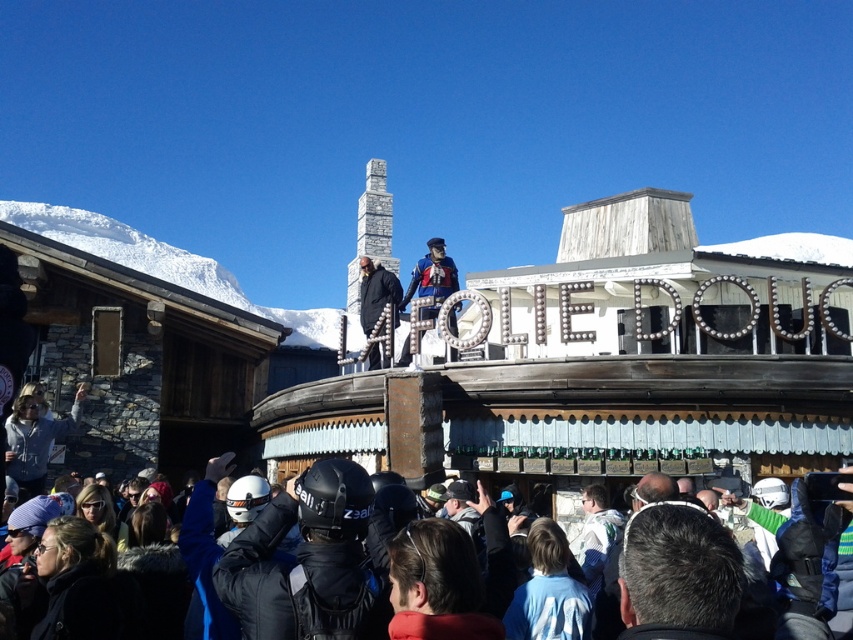
Does dark brown hair at center have a lesser width compared to blue fabric skier at center?

Yes.

Can you confirm if dark brown hair at center is taller than blue fabric skier at center?

Incorrect, dark brown hair at center's height is not larger of blue fabric skier at center's.

Does point (671, 557) come closer to viewer compared to point (422, 296)?

Yes, point (671, 557) is closer to viewer.

Where is `dark brown hair at center`? The width and height of the screenshot is (853, 640). dark brown hair at center is located at coordinates (677, 573).

Between black matte coat at center and dark blue jacket at lower center, which one appears on the right side from the viewer's perspective?

dark blue jacket at lower center is more to the right.

Does black matte coat at center have a lesser height compared to dark blue jacket at lower center?

In fact, black matte coat at center may be taller than dark blue jacket at lower center.

Is point (380, 289) positioned after point (850, 490)?

That is True.

This screenshot has height=640, width=853. Identify the location of black matte coat at center. (376, 292).

Is point (230, 550) more distant than point (421, 262)?

That is False.

Locate an element on the screen. black matte helmet at center is located at coordinates (308, 561).